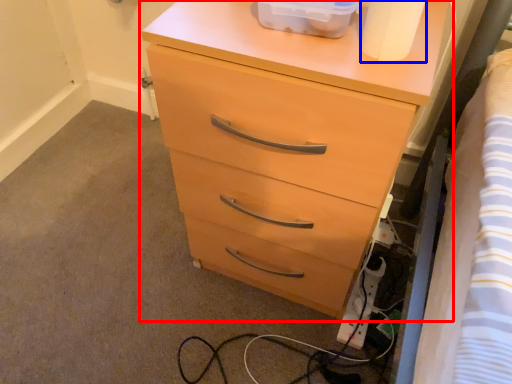
Question: Which object appears closest to the camera in this image, chest of drawers (highlighted by a red box) or toilet paper (highlighted by a blue box)?

Choices:
 (A) chest of drawers
 (B) toilet paper

Answer: (B)